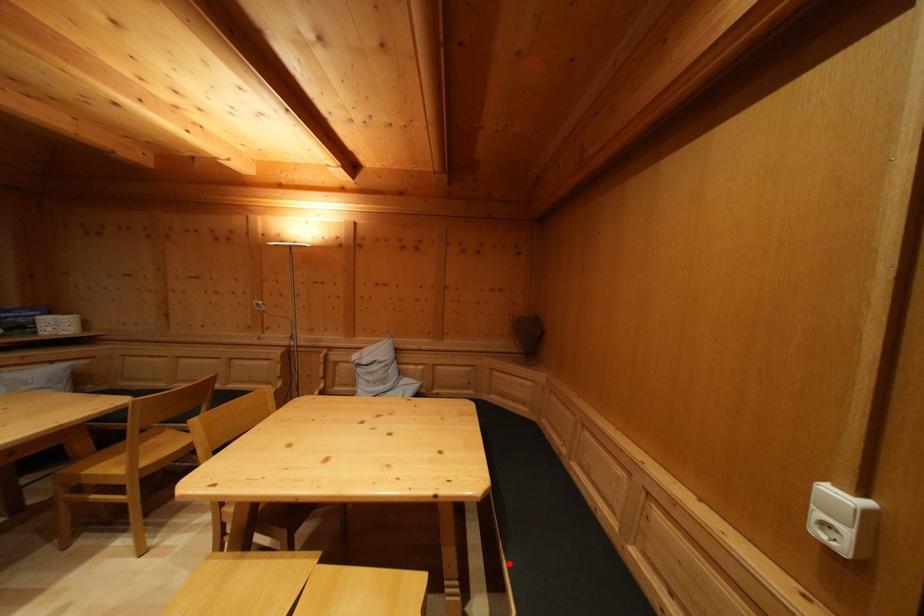
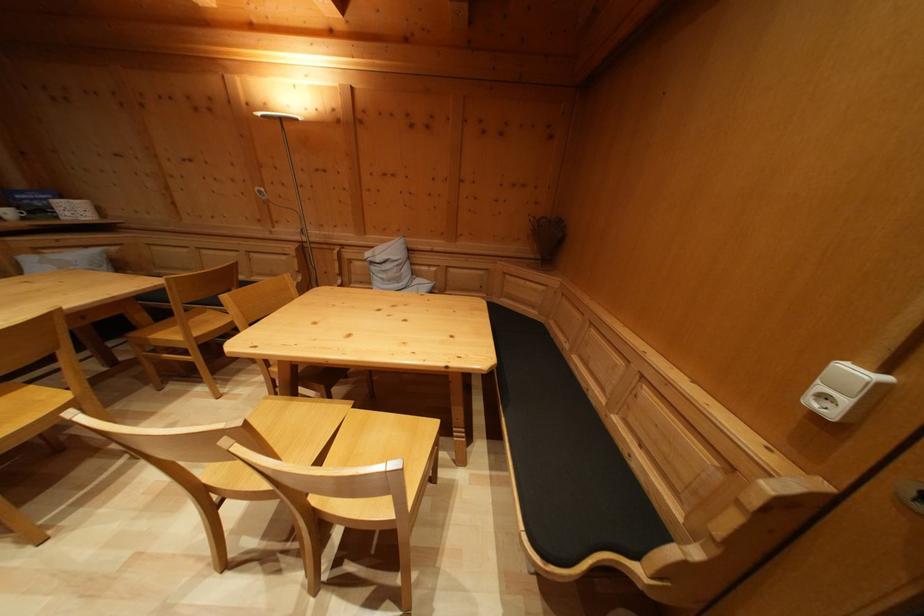
Locate, in the second image, the point that corresponds to the highlighted location in the first image.

(507, 422)